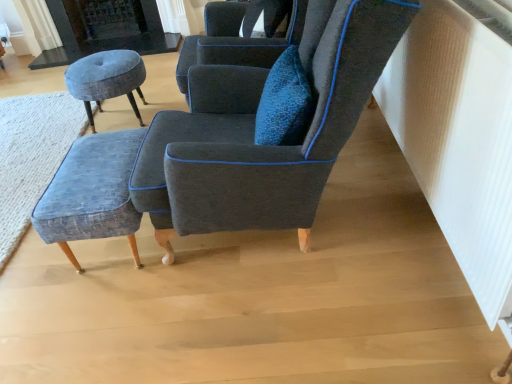
Question: From the image's perspective, is velvet dark blue armchair at center, which is counted as the first chair, starting from the back, on textured blue fabric stool at lower left, acting as the 2th stool starting from the back?

Choices:
 (A) no
 (B) yes

Answer: (B)

Question: From the image's perspective, would you say velvet dark blue armchair at center, placed as the 2th chair when sorted from front to back, is shown under textured blue fabric stool at lower left, which ranks as the second stool in top-to-bottom order?

Choices:
 (A) no
 (B) yes

Answer: (A)

Question: Considering the relative sizes of velvet dark blue armchair at center, which is counted as the first chair, starting from the back, and textured blue fabric stool at lower left, the first stool in the front-to-back sequence, in the image provided, is velvet dark blue armchair at center, which is counted as the first chair, starting from the back, smaller than textured blue fabric stool at lower left, the first stool in the front-to-back sequence,?

Choices:
 (A) no
 (B) yes

Answer: (A)

Question: Does velvet dark blue armchair at center, placed as the 2th chair when sorted from front to back, have a greater width compared to textured blue fabric stool at lower left, placed as the 1th stool when sorted from bottom to top?

Choices:
 (A) no
 (B) yes

Answer: (B)

Question: Can you confirm if velvet dark blue armchair at center, placed as the 2th chair when sorted from front to back, is thinner than textured blue fabric stool at lower left, the first stool in the front-to-back sequence?

Choices:
 (A) no
 (B) yes

Answer: (A)

Question: From a real-world perspective, is velvet dark blue armchair at center, placed as the 2th chair when sorted from front to back, physically below textured blue fabric stool at lower left, which ranks as the second stool in top-to-bottom order?

Choices:
 (A) yes
 (B) no

Answer: (B)

Question: Can you confirm if velvet dark blue armchair at center, which is counted as the first chair, starting from the back, is shorter than velvet blue armchair at center, placed as the second chair when sorted from back to front?

Choices:
 (A) yes
 (B) no

Answer: (A)

Question: From the image's perspective, is velvet dark blue armchair at center, which is counted as the first chair, starting from the back, beneath velvet blue armchair at center, placed as the second chair when sorted from back to front?

Choices:
 (A) no
 (B) yes

Answer: (A)

Question: Is velvet dark blue armchair at center, placed as the 2th chair when sorted from front to back, surrounding velvet blue armchair at center, which is the first chair from front to back?

Choices:
 (A) yes
 (B) no

Answer: (B)

Question: Is velvet dark blue armchair at center, placed as the 2th chair when sorted from front to back, at the right side of velvet blue armchair at center, placed as the second chair when sorted from back to front?

Choices:
 (A) no
 (B) yes

Answer: (A)

Question: Does velvet dark blue armchair at center, which is counted as the first chair, starting from the back, have a greater width compared to velvet blue armchair at center, which is the first chair from front to back?

Choices:
 (A) no
 (B) yes

Answer: (A)

Question: Does velvet dark blue armchair at center, which is counted as the first chair, starting from the back, have a greater height compared to velvet blue armchair at center, which is the first chair from front to back?

Choices:
 (A) yes
 (B) no

Answer: (B)

Question: Does velvet blue stool at left, the second stool from the bottom, have a greater height compared to velvet blue ottoman at lower left?

Choices:
 (A) no
 (B) yes

Answer: (B)